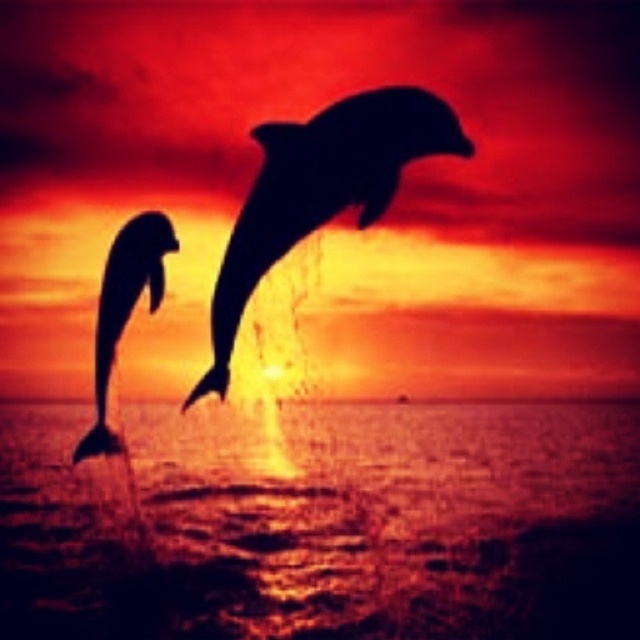
Is transparent water at lower center smaller than black silhouette dolphin at center?

Incorrect, transparent water at lower center is not smaller in size than black silhouette dolphin at center.

Is transparent water at lower center shorter than black silhouette dolphin at center?

In fact, transparent water at lower center may be taller than black silhouette dolphin at center.

The width and height of the screenshot is (640, 640). I want to click on transparent water at lower center, so [x=324, y=524].

Which of these two, transparent water at lower center or silhouette dolphin at left, stands shorter?

With less height is silhouette dolphin at left.

Can you confirm if transparent water at lower center is bigger than silhouette dolphin at left?

Indeed, transparent water at lower center has a larger size compared to silhouette dolphin at left.

Who is more distant from viewer, (474,612) or (154,262)?

Point (474,612)

The width and height of the screenshot is (640, 640). I want to click on transparent water at lower center, so click(324, 524).

Which of these two, black silhouette dolphin at center or silhouette dolphin at left, stands taller?

With more height is silhouette dolphin at left.

Between black silhouette dolphin at center and silhouette dolphin at left, which one is positioned higher?

black silhouette dolphin at center is higher up.

What do you see at coordinates (321, 189) in the screenshot? The width and height of the screenshot is (640, 640). I see `black silhouette dolphin at center` at bounding box center [321, 189].

The width and height of the screenshot is (640, 640). What are the coordinates of `black silhouette dolphin at center` in the screenshot? It's located at (321, 189).